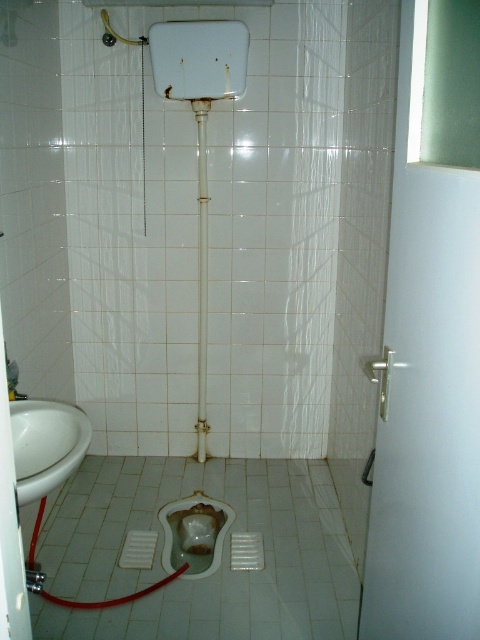
Does white glossy sink at left come in front of matte white toilet bowl at center?

Yes, white glossy sink at left is in front of matte white toilet bowl at center.

Is point (48, 445) positioned after point (224, 506)?

No, it is in front of (224, 506).

Which is behind, point (69, 452) or point (175, 541)?

Positioned behind is point (175, 541).

The width and height of the screenshot is (480, 640). Find the location of `white glossy sink at left`. white glossy sink at left is located at coordinates (46, 444).

Who is shorter, white glossy sink at left or metallic pipe at center?

white glossy sink at left is shorter.

Is white glossy sink at left wider than metallic pipe at center?

Yes, white glossy sink at left is wider than metallic pipe at center.

Is point (39, 476) farther from viewer compared to point (202, 220)?

No.

Locate an element on the screen. white glossy sink at left is located at coordinates (46, 444).

Based on the photo, does matte white toilet bowl at center have a greater height compared to metallic silver shower head at upper left?

Yes, matte white toilet bowl at center is taller than metallic silver shower head at upper left.

Is matte white toilet bowl at center further to the viewer compared to metallic silver shower head at upper left?

No, it is not.

Identify the location of matte white toilet bowl at center. (180, 536).

The height and width of the screenshot is (640, 480). I want to click on matte white toilet bowl at center, so click(180, 536).